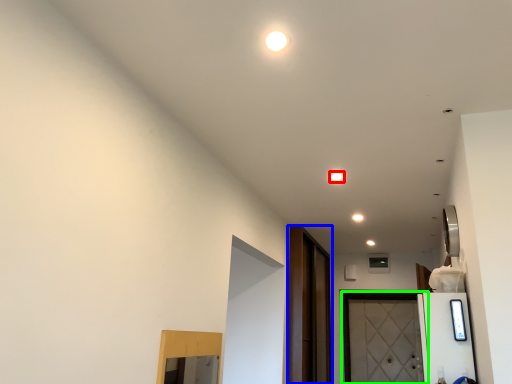
Question: Estimate the real-world distances between objects in this image. Which object is farther from light (highlighted by a red box), screen door (highlighted by a blue box) or door (highlighted by a green box)?

Choices:
 (A) screen door
 (B) door

Answer: (B)